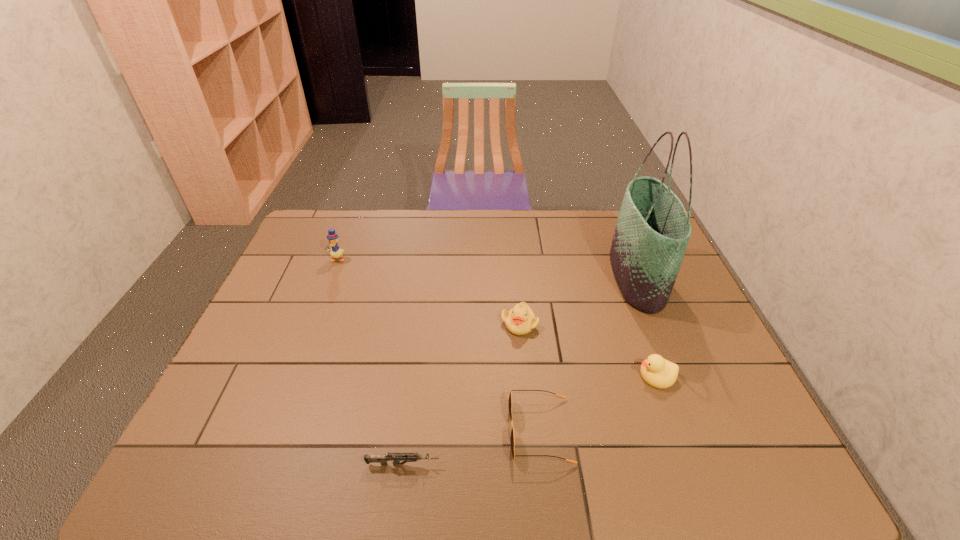
Where is `vacant space located 0.200m on the face of the leftmost duckling, where the monocle is placed`? vacant space located 0.200m on the face of the leftmost duckling, where the monocle is placed is located at coordinates 319,306.

Where is `vacant space located at the face of the second farthest duckling`? The width and height of the screenshot is (960, 540). vacant space located at the face of the second farthest duckling is located at coordinates (527, 404).

At what (x,y) coordinates should I click in order to perform the action: click on vacant space located on the face of the third nearest object. Please return your answer as a coordinate pair (x, y). The height and width of the screenshot is (540, 960). Looking at the image, I should click on (483, 376).

I want to click on vacant area situated 0.380m on the face of the third nearest object, so click(487, 376).

The height and width of the screenshot is (540, 960). Find the location of `free space located on the face of the third nearest object`. free space located on the face of the third nearest object is located at coordinates (511, 376).

I want to click on free space located 0.350m on the front-facing side of the fifth tallest object, so click(x=354, y=430).

Identify the location of vacant space located on the front-facing side of the fifth tallest object. Image resolution: width=960 pixels, height=540 pixels. (420, 430).

Locate an element on the screen. The width and height of the screenshot is (960, 540). vacant region located 0.150m on the front-facing side of the fifth tallest object is located at coordinates (443, 430).

Find the location of a particular element. free space located aimed along the barrel of the gun is located at coordinates (543, 464).

Locate an element on the screen. The height and width of the screenshot is (540, 960). object located at the far edge is located at coordinates (652, 232).